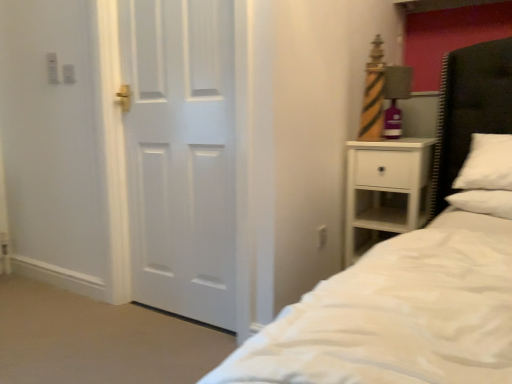
Question: Does point (362, 220) appear closer or farther from the camera than point (389, 92)?

Choices:
 (A) closer
 (B) farther

Answer: (B)

Question: Visually, is white matte nightstand at right positioned to the left or to the right of matte striped lamp at right?

Choices:
 (A) right
 (B) left

Answer: (A)

Question: Which of these objects is positioned farthest from the white glossy door at left?

Choices:
 (A) white soft pillow at right
 (B) black leather headboard at right
 (C) white matte nightstand at right
 (D) matte striped lamp at right

Answer: (B)

Question: Which is farther from the black leather headboard at right?

Choices:
 (A) white soft pillow at right
 (B) white glossy door at left
 (C) white matte nightstand at right
 (D) matte striped lamp at right

Answer: (B)